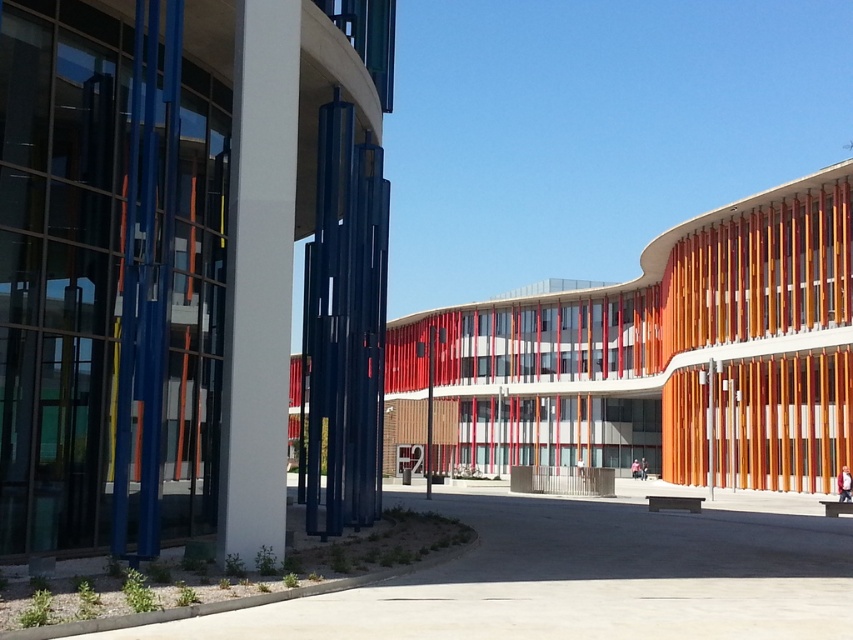
Which is more to the left, polished glass wind chimes at center or orange wood building at center?

From the viewer's perspective, polished glass wind chimes at center appears more on the left side.

Based on the photo, between polished glass wind chimes at center and orange wood building at center, which one has less height?

With less height is polished glass wind chimes at center.

Find the location of a particular element. The image size is (853, 640). polished glass wind chimes at center is located at coordinates (186, 266).

What do you see at coordinates (666, 353) in the screenshot?
I see `orange wood building at center` at bounding box center [666, 353].

From the picture: Is orange wood building at center to the right of white smooth pillar at center from the viewer's perspective?

Indeed, orange wood building at center is positioned on the right side of white smooth pillar at center.

Which is behind, point (509, 401) or point (268, 170)?

Point (509, 401)

The image size is (853, 640). Identify the location of orange wood building at center. (666, 353).

Can you confirm if polished glass wind chimes at center is positioned to the right of white smooth pillar at center?

No, polished glass wind chimes at center is not to the right of white smooth pillar at center.

Is point (10, 392) positioned after point (286, 440)?

No, it is not.

What are the coordinates of `polished glass wind chimes at center` in the screenshot? It's located at (186, 266).

At what (x,y) coordinates should I click in order to perform the action: click on polished glass wind chimes at center. Please return your answer as a coordinate pair (x, y). Looking at the image, I should click on (186, 266).